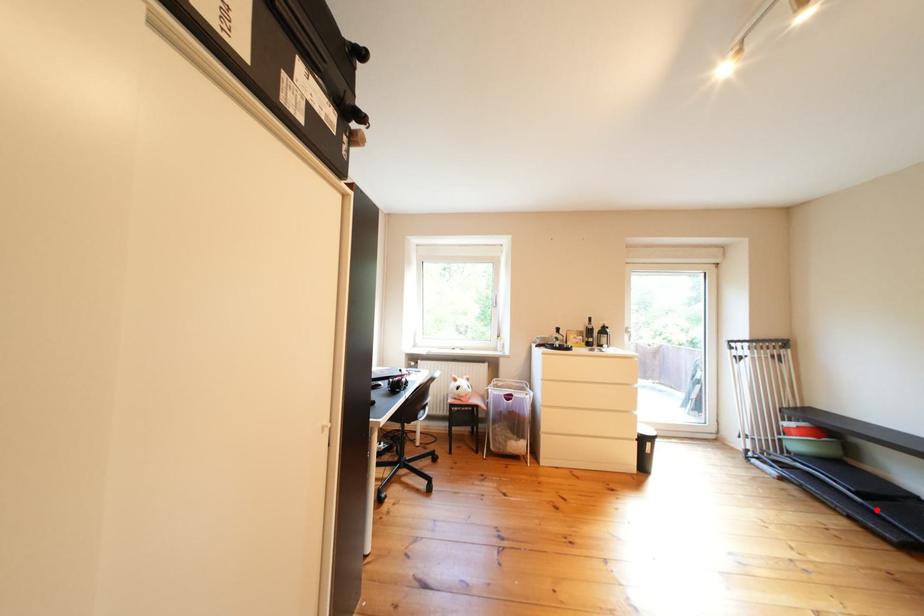
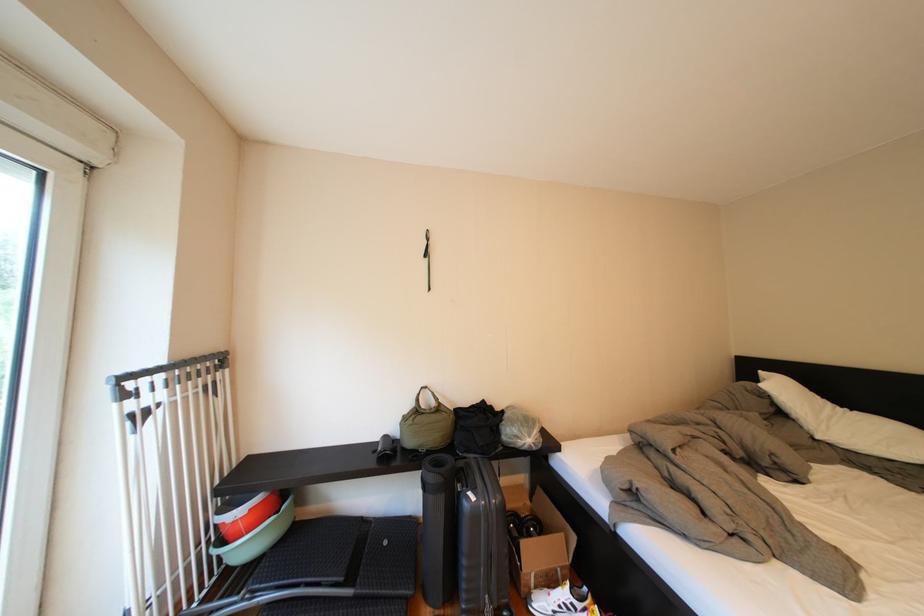
Where in the second image is the point corresponding to the highlighted location from the first image?

(370, 602)